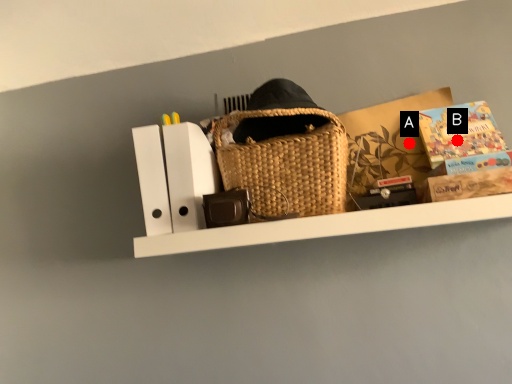
Question: Two points are circled on the image, labeled by A and B beside each circle. Which of the following is the closest to the observer?

Choices:
 (A) A is closer
 (B) B is closer

Answer: (B)